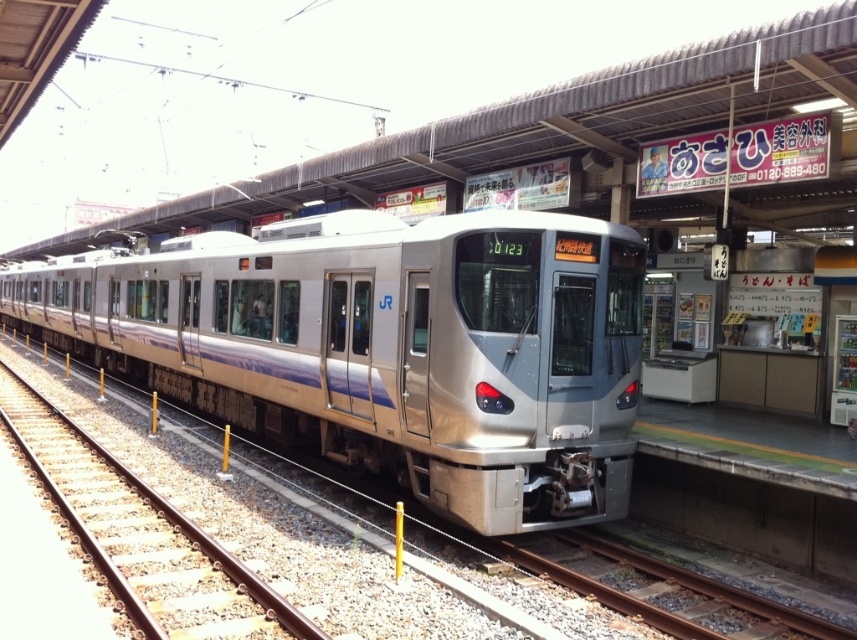
Is silver metallic train at center wider than rusty metal train track at lower center?

Yes.

Image resolution: width=857 pixels, height=640 pixels. What are the coordinates of `silver metallic train at center` in the screenshot? It's located at (387, 348).

The width and height of the screenshot is (857, 640). In order to click on silver metallic train at center in this screenshot , I will do `click(387, 348)`.